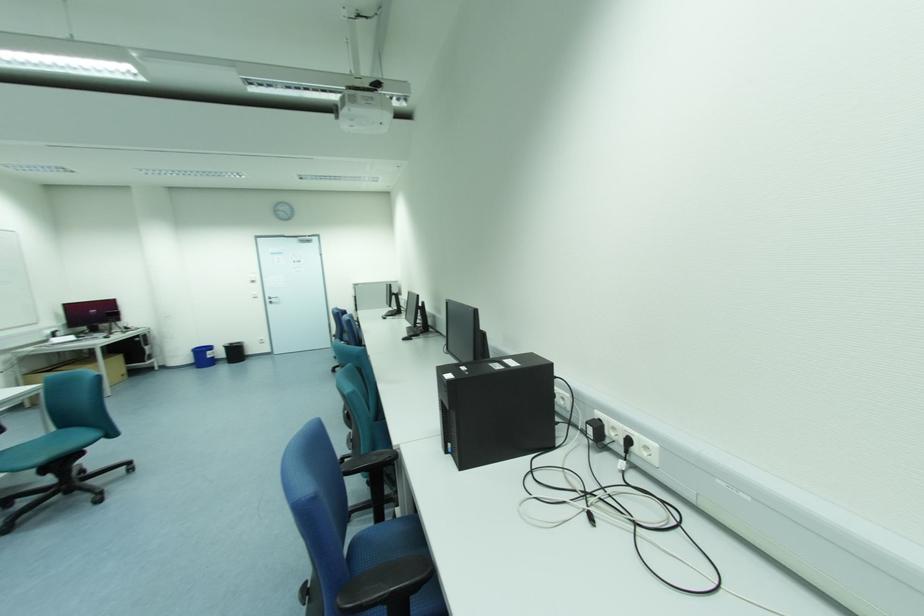
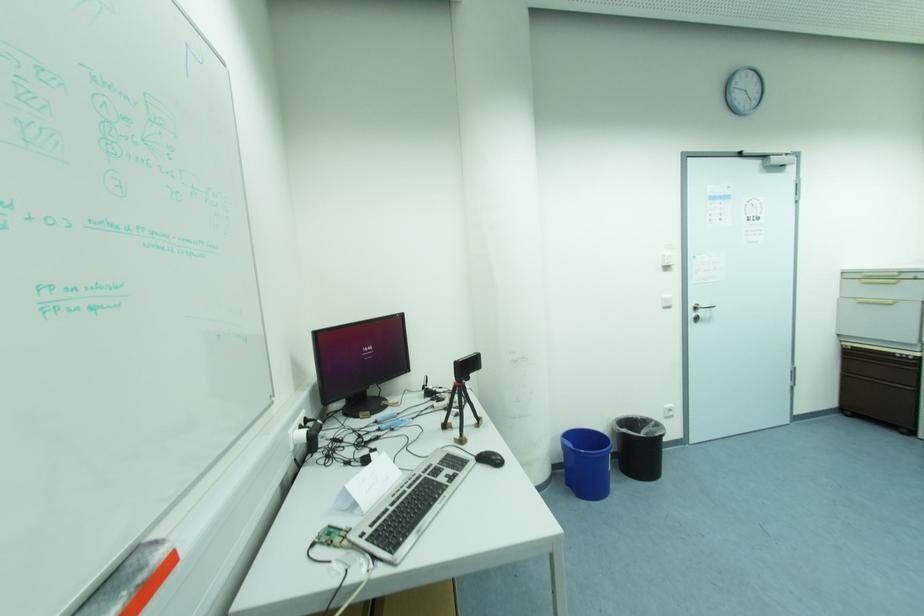
Find the pixel in the second image that matches point (116, 300) in the first image.

(402, 317)